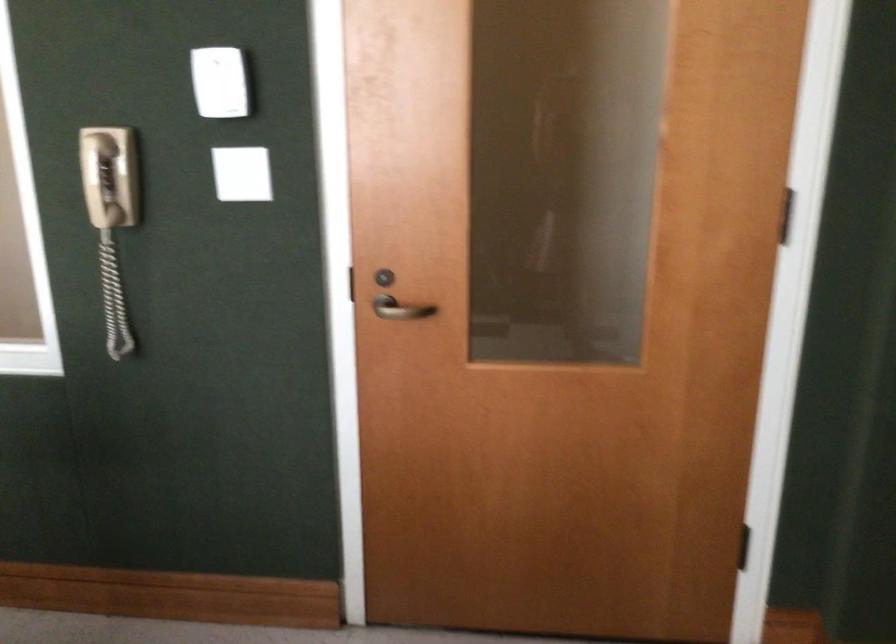
Where is `telephone handset`? The width and height of the screenshot is (896, 644). telephone handset is located at coordinates (99, 180).